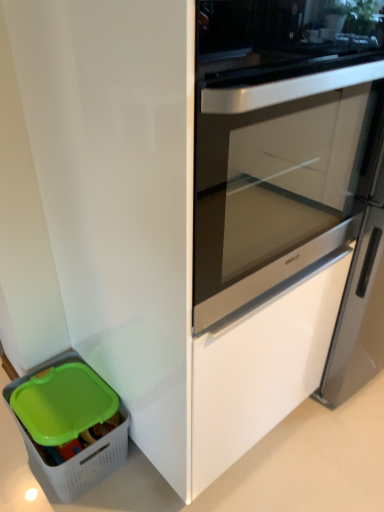
Identify the location of vacant point above white plastic basket at lower left (from a real-world perspective). (56, 391).